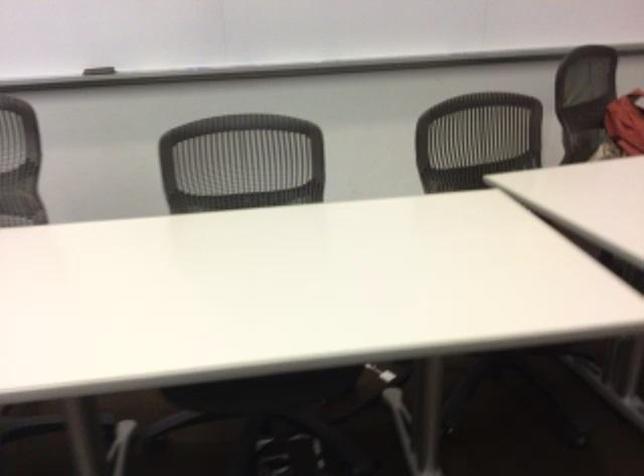
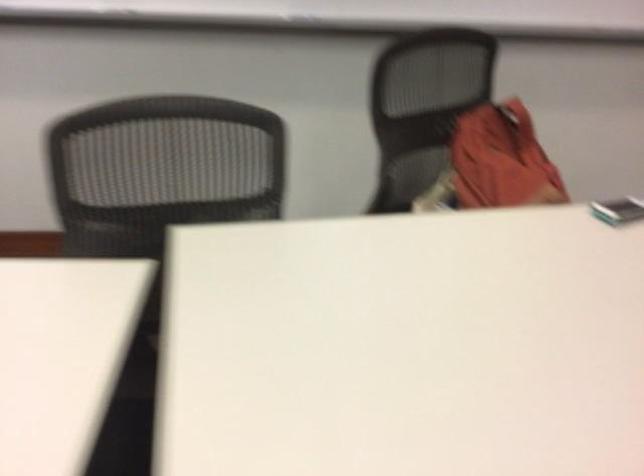
The images are taken continuously from a first-person perspective. In which direction are you moving?

The cameraman moved toward right, forward.